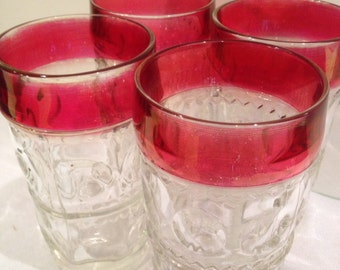
The image size is (340, 270). In order to click on drinking glass in this screenshot , I will do `click(85, 155)`.